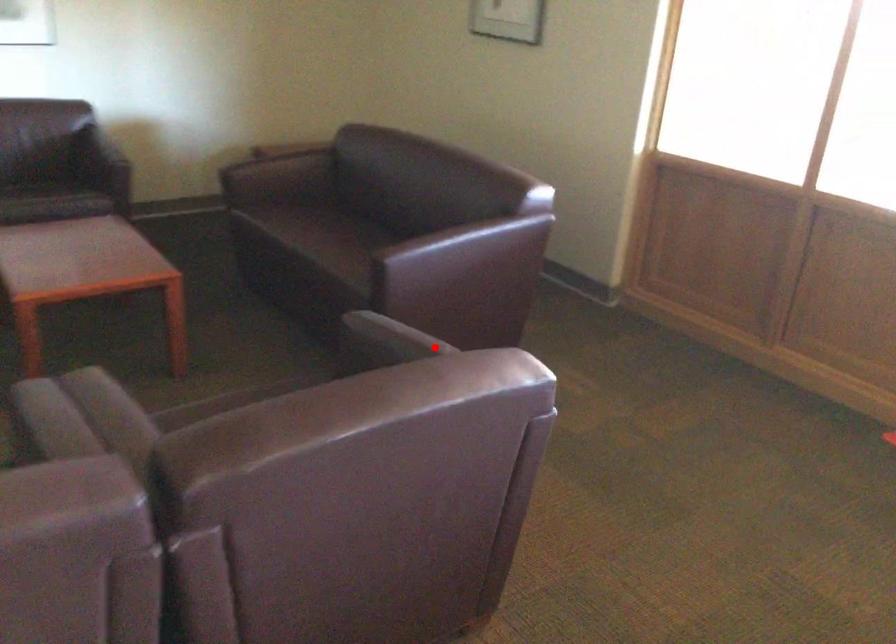
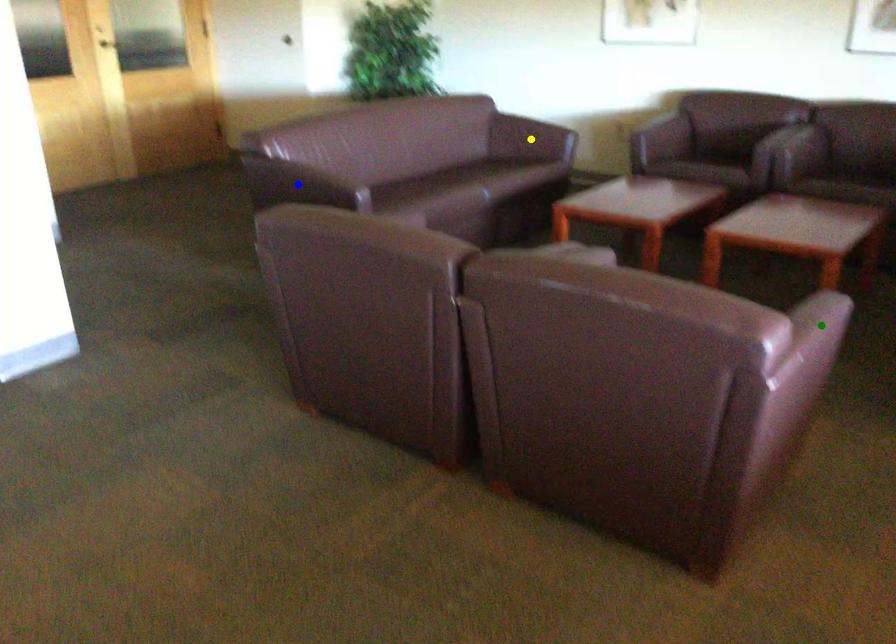
Question: I am providing you with two images of the same scene from different viewpoints. A red point is marked on the first image. You are given multiple points on the second image. In image 2, which mark is for the same physical point as the one in image 1?

Choices:
 (A) blue point
 (B) yellow point
 (C) green point

Answer: (C)